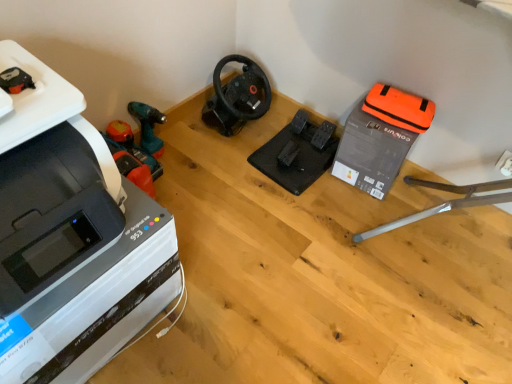
Locate an element on the screen. The height and width of the screenshot is (384, 512). vacant space in between black rubber pedals at center, which is the second equipment in right-to-left order, and orange fabric bag at upper right, which appears as the second equipment when viewed from the left is located at coordinates (336, 195).